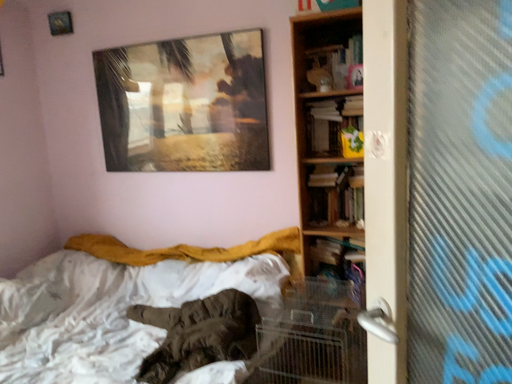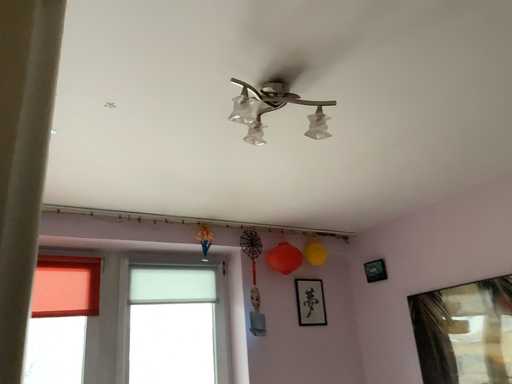
Question: Which way did the camera rotate in the video?

Choices:
 (A) rotated downward
 (B) rotated upward

Answer: (B)